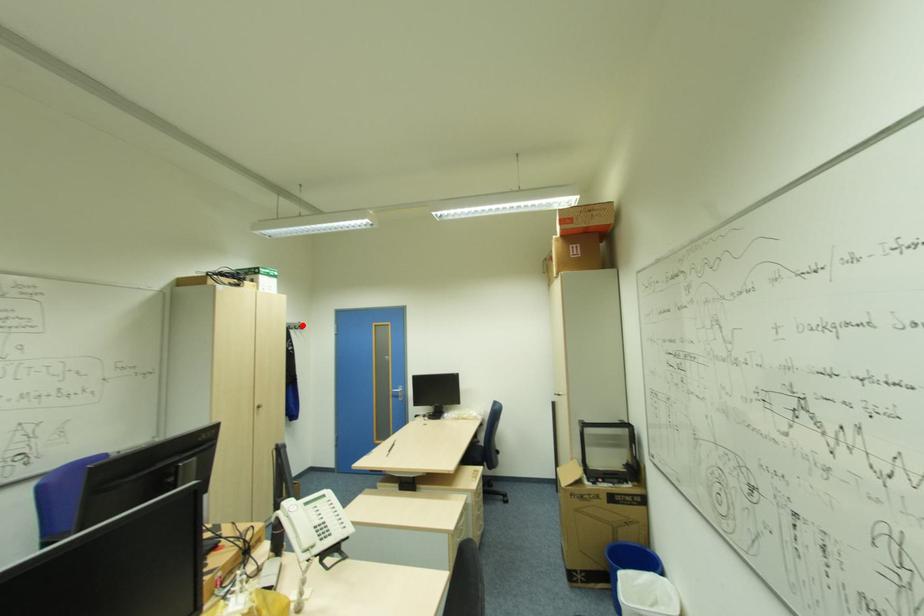
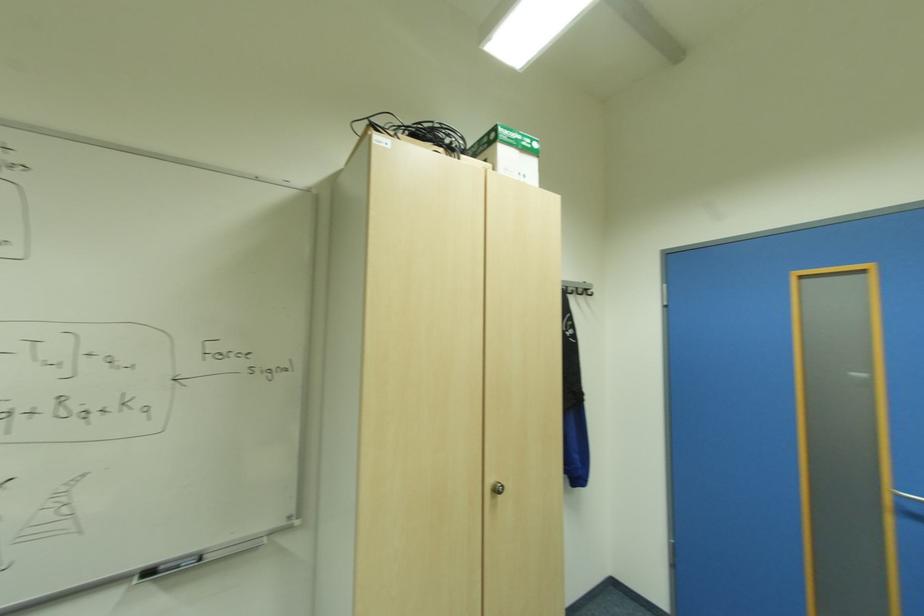
Find the pixel in the second image that matches the highlighted location in the first image.

(588, 291)